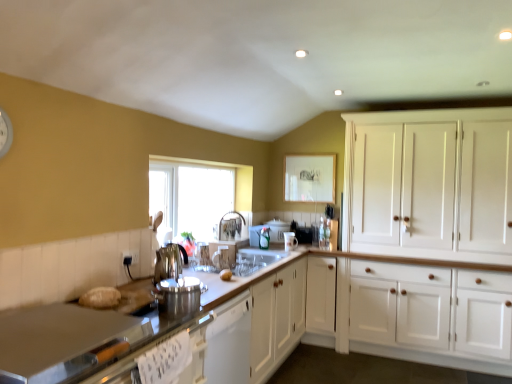
Question: From the image's perspective, relative to white glossy mug at center, marked as the second appliance in a right-to-left arrangement, is polished stainless steel kettle at center, arranged as the fifth appliance when viewed from the right, above or below?

Choices:
 (A) below
 (B) above

Answer: (B)

Question: Does point (161, 266) appear closer or farther from the camera than point (292, 236)?

Choices:
 (A) closer
 (B) farther

Answer: (A)

Question: Which object is positioned closest to the metallic silver toaster at center, the 1th appliance viewed from the back?

Choices:
 (A) polished stainless steel kettle at center, the second appliance viewed from the front
 (B) clear glass window at center
 (C) bread matte at center
 (D) white glossy mug at center, the fourth appliance viewed from the left
 (E) polished stainless steel faucet at center

Answer: (D)

Question: Based on their relative distances, which object is farther from the bread matte at center?

Choices:
 (A) metallic silver toaster at center, arranged as the fifth appliance when viewed from the front
 (B) polished stainless steel kettle at center, the fourth appliance viewed from the back
 (C) clear glass window at center
 (D) white plastic toaster at center, the 2th appliance when ordered from back to front
 (E) white wood cabinet at right

Answer: (E)